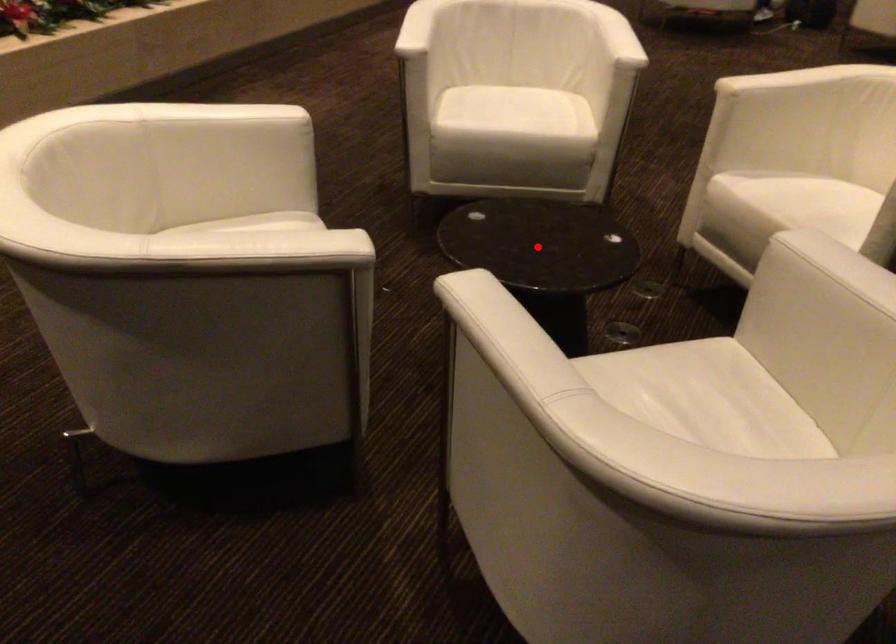
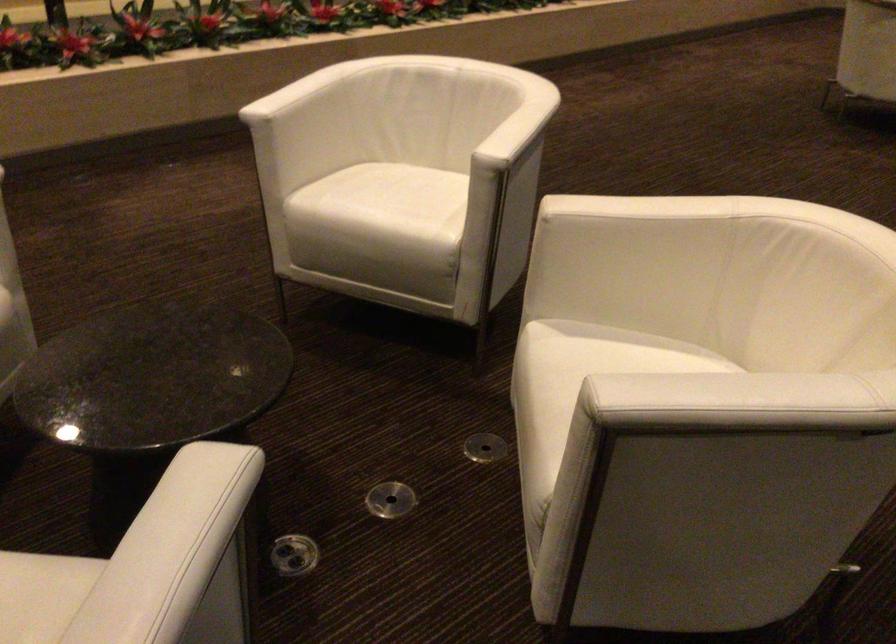
The point at the highlighted location is marked in the first image. Where is the corresponding point in the second image?

(152, 377)